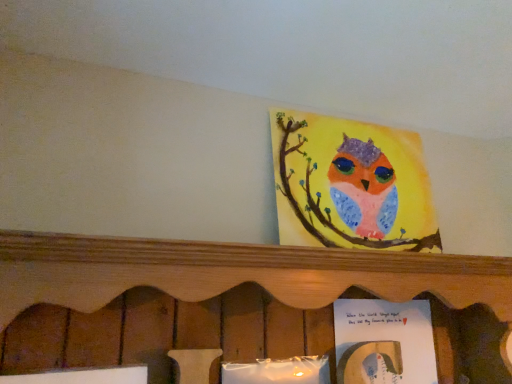
This screenshot has height=384, width=512. Describe the element at coordinates (354, 182) in the screenshot. I see `watercolor owl at upper right` at that location.

You are a GUI agent. You are given a task and a screenshot of the screen. Output one action in this format:
    pyautogui.click(x=<x>, y=<y>)
    Task: Click on the watercolor owl at upper right
    
    Given the screenshot: What is the action you would take?
    pyautogui.click(x=354, y=182)

What is the approximate height of watercolor owl at upper right?

watercolor owl at upper right is 37.99 centimeters tall.

Where is `watercolor owl at upper right`? The height and width of the screenshot is (384, 512). watercolor owl at upper right is located at coordinates (354, 182).